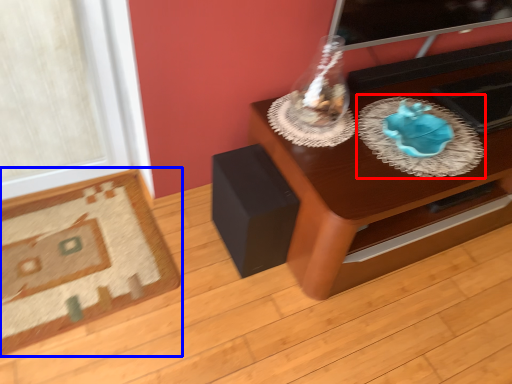
Question: Which object appears closest to the camera in this image, glass plate (highlighted by a red box) or furniture (highlighted by a blue box)?

Choices:
 (A) glass plate
 (B) furniture

Answer: (A)